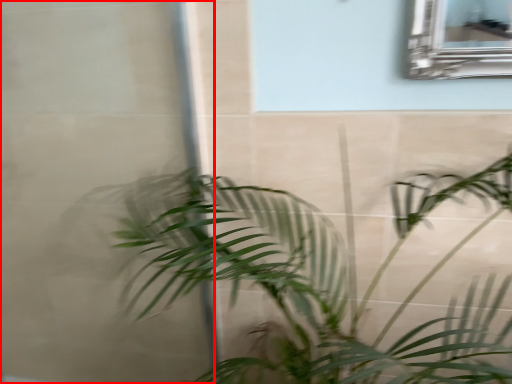
Question: From the image's perspective, what is the correct spatial positioning of glass door (annotated by the red box) in reference to houseplant?

Choices:
 (A) below
 (B) above

Answer: (B)